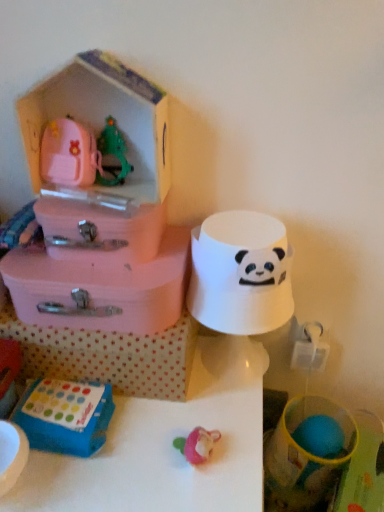
Where is `free space in front of white felt hat at right, the 2th toy in the bottom-to-top sequence`? The width and height of the screenshot is (384, 512). free space in front of white felt hat at right, the 2th toy in the bottom-to-top sequence is located at coordinates (213, 434).